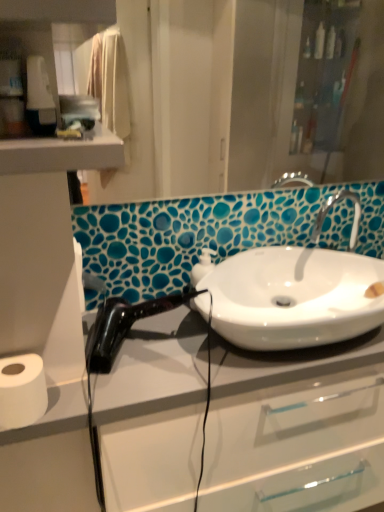
You are a GUI agent. You are given a task and a screenshot of the screen. Output one action in this format:
    pyautogui.click(x=<x>, y=<y>)
    Task: Click on the vacant region to the right of white matte toilet paper at lower left
    The image size is (384, 512).
    Given the screenshot: What is the action you would take?
    pyautogui.click(x=111, y=387)